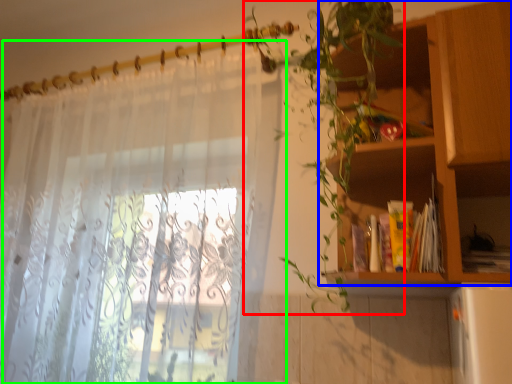
Question: Based on their relative distances, which object is farther from vegetation (highlighted by a red box)? Choose from shelf (highlighted by a blue box) and curtain (highlighted by a green box).

Choices:
 (A) shelf
 (B) curtain

Answer: (B)